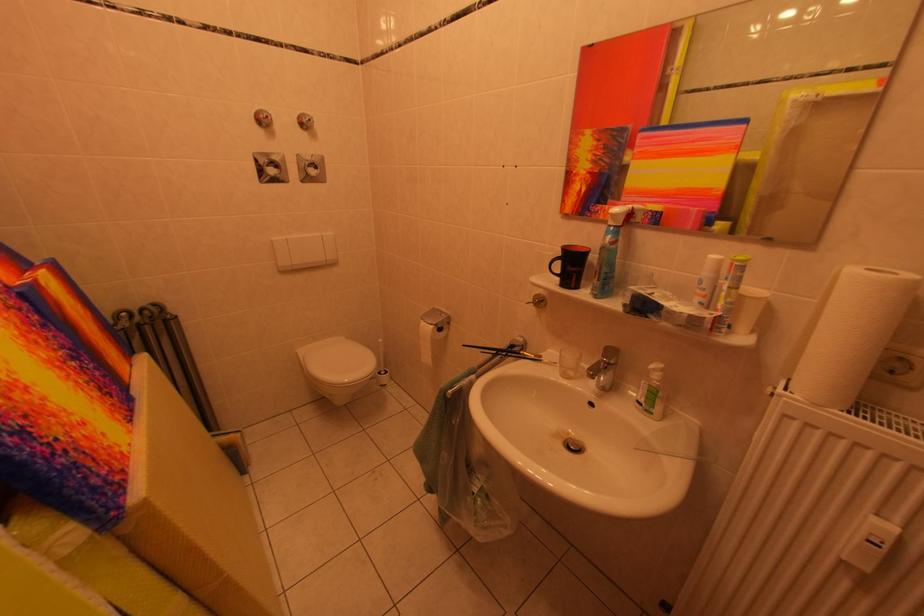
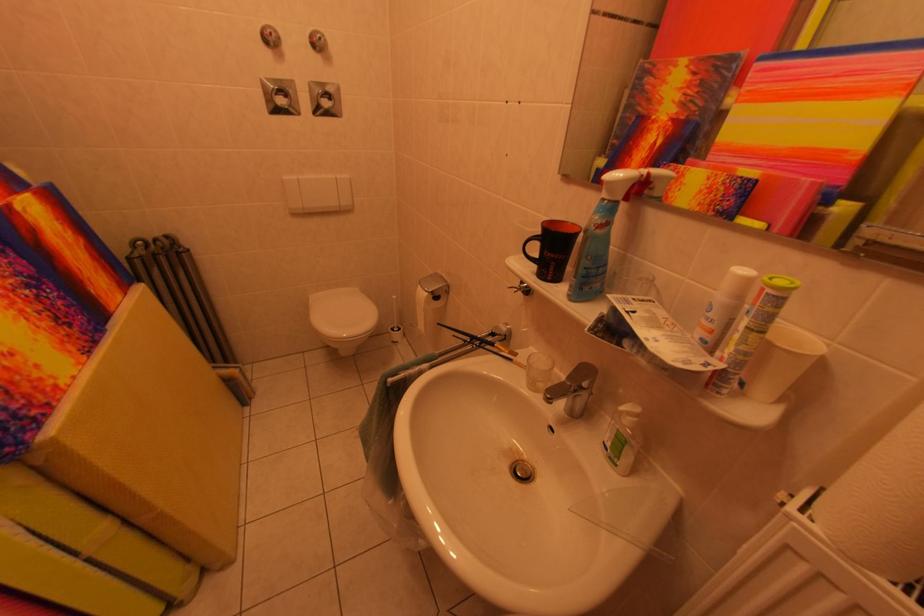
The point at (x=612, y=360) is marked in the first image. Where is the corresponding point in the second image?

(578, 382)